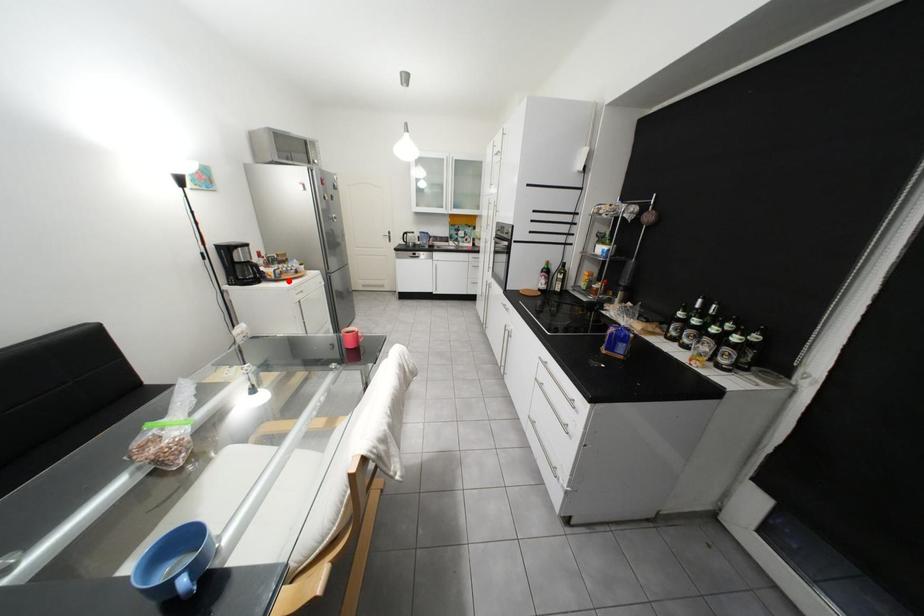
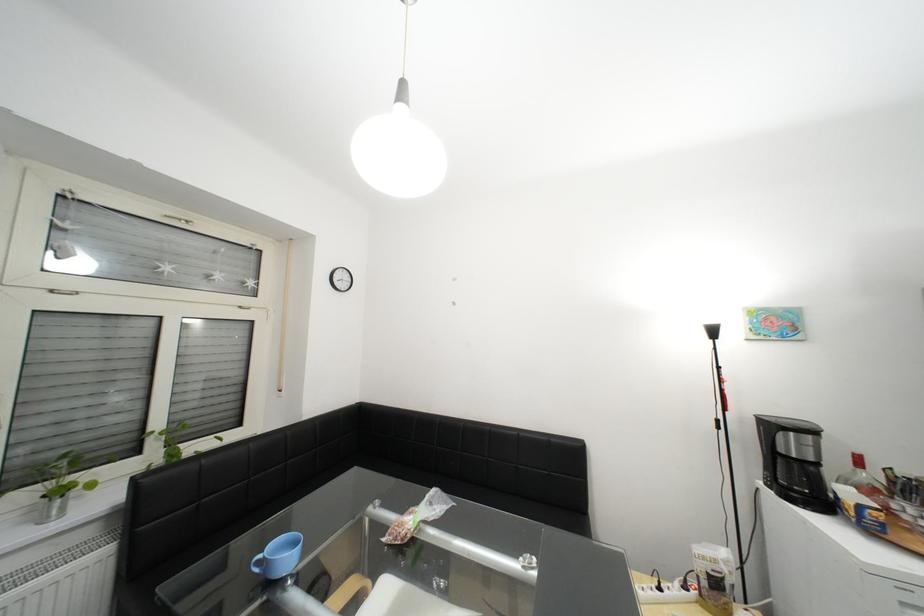
Locate, in the second image, the point that corresponds to the highlighted location in the first image.

(886, 533)